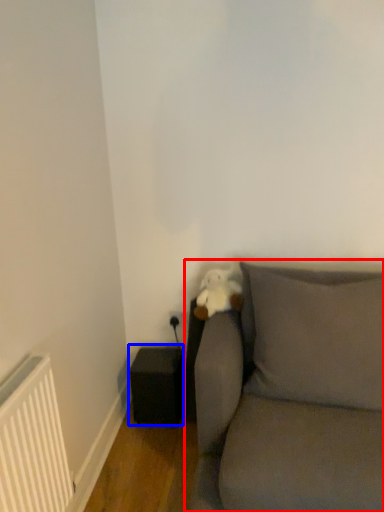
Question: Which point is further to the camera, studio couch (highlighted by a red box) or speaker (highlighted by a blue box)?

Choices:
 (A) studio couch
 (B) speaker

Answer: (B)